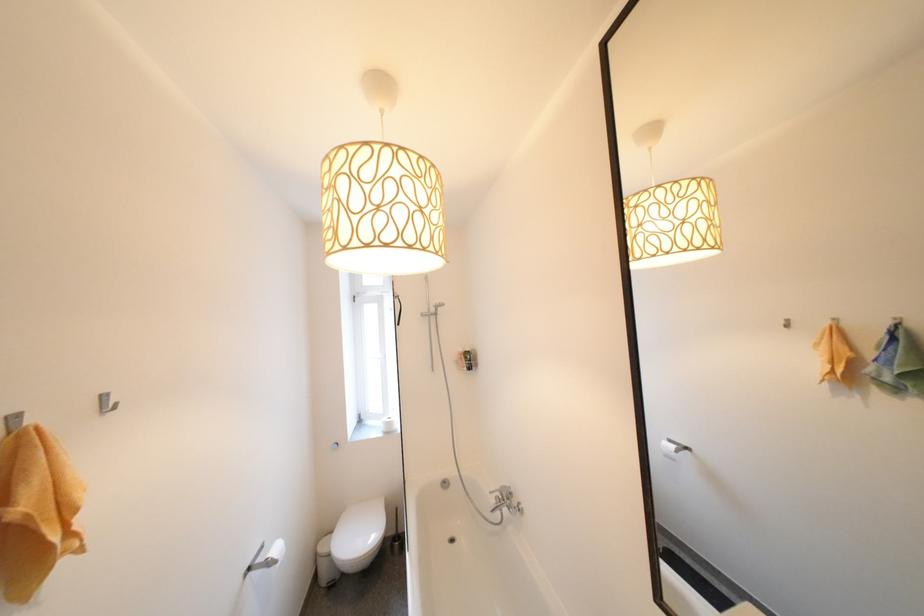
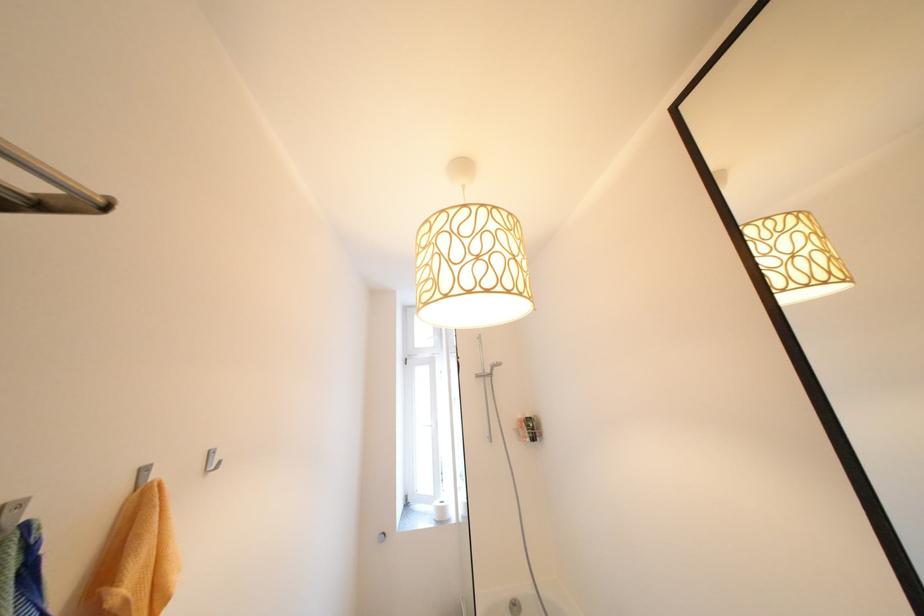
Locate, in the second image, the point that corresponds to the point at 395,419 in the first image.

(447, 504)